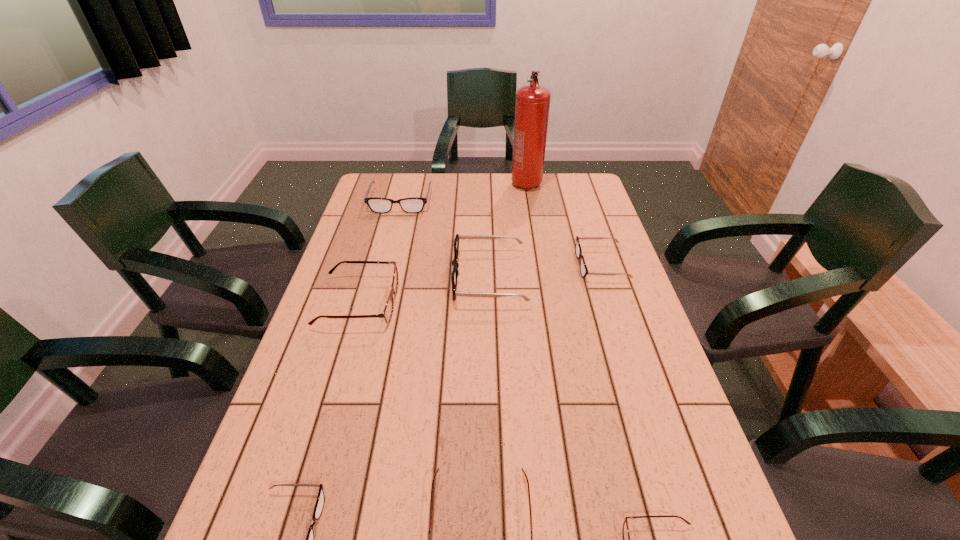
Locate an element on the screen. the second closest spectacles to the second red spectacles from right to left is located at coordinates coord(320,501).

Locate an element on the screen. spectacles that is the sixth closest one to the farthest spectacles is located at coordinates [x=625, y=530].

Locate an element on the screen. The height and width of the screenshot is (540, 960). black spectacles that stands as the closest to the smallest black spectacles is located at coordinates (455, 264).

Where is `the closest black spectacles to the red fire extinguisher`? This screenshot has width=960, height=540. the closest black spectacles to the red fire extinguisher is located at coordinates (414, 204).

Where is `red spectacles that stands as the second closest to the farthest spectacles`? The width and height of the screenshot is (960, 540). red spectacles that stands as the second closest to the farthest spectacles is located at coordinates (437, 471).

Locate which red spectacles is the second closest to the second smallest black spectacles. Please provide its 2D coordinates. Your answer should be formatted as a tuple, i.e. [(x, y)], where the tuple contains the x and y coordinates of a point satisfying the conditions above.

[(437, 471)]